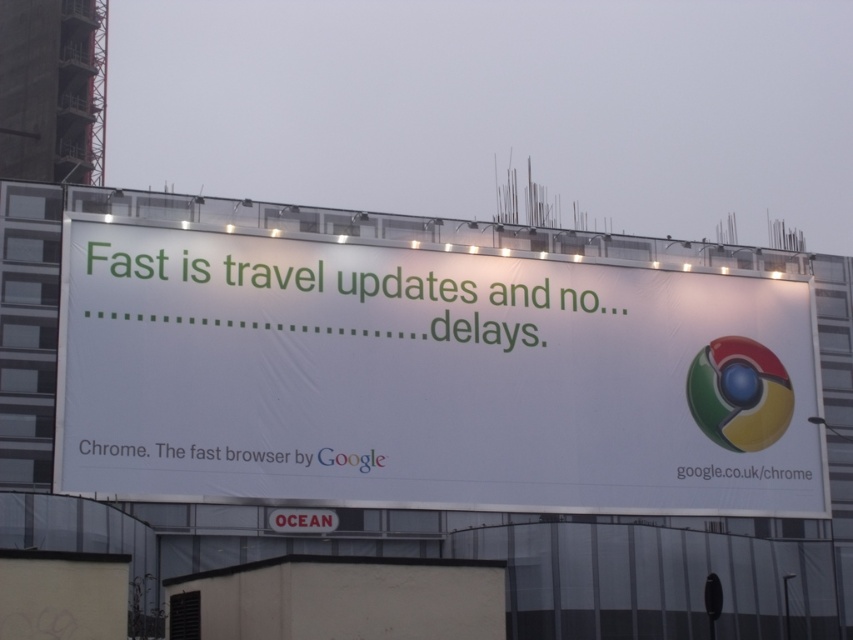
You are standing in front of the billboard and want to touch both points mentioned. Which point should you reach for first, the point at coordinate [747,292] or the point at coordinate [773,380]?

You should reach for the point at coordinate [747,292] first because it is closer to you than the point at coordinate [773,380].

You are standing in front of the building and want to see both the white paper billboard at center and the shiny chrome beach ball at right. Which object is located higher up?

The white paper billboard at center is positioned over the shiny chrome beach ball at right, so it is higher up.

You are a delivery person who needs to place a shiny chrome beach ball at right on top of the white paper billboard at center. Can you do this without the beach ball falling off?

The white paper billboard at center has a larger size compared to shiny chrome beach ball at right, so the beach ball will fit and stay on top without falling off.